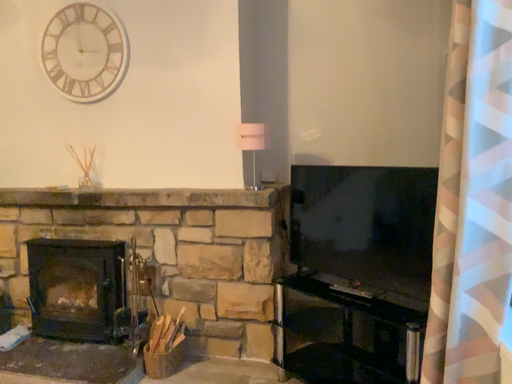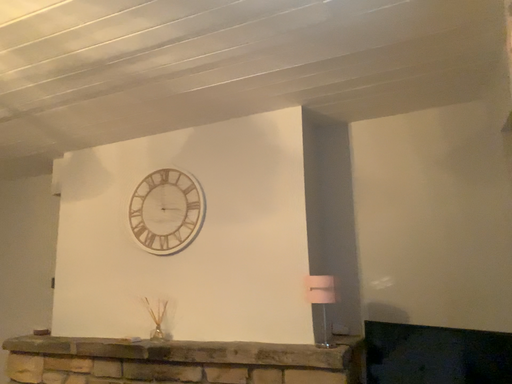
Question: How did the camera likely rotate when shooting the video?

Choices:
 (A) rotated upward
 (B) rotated downward

Answer: (A)